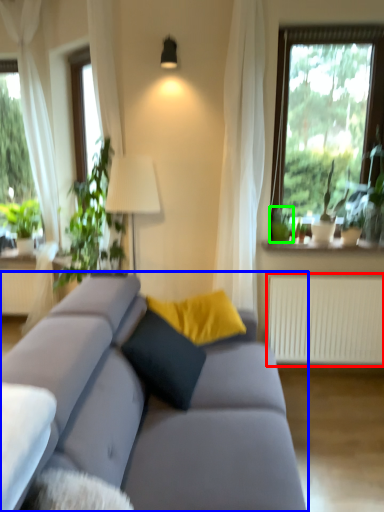
Question: Estimate the real-world distances between objects in this image. Which object is closer to radiator (highlighted by a red box), studio couch (highlighted by a blue box) or plant (highlighted by a green box)?

Choices:
 (A) studio couch
 (B) plant

Answer: (B)